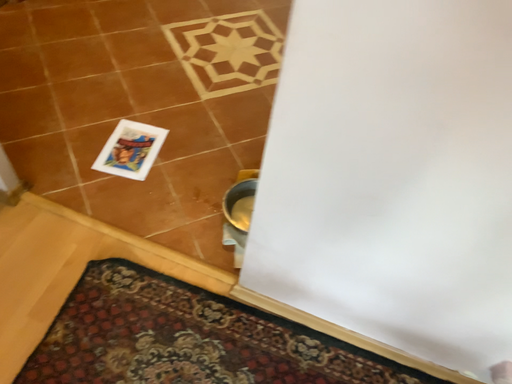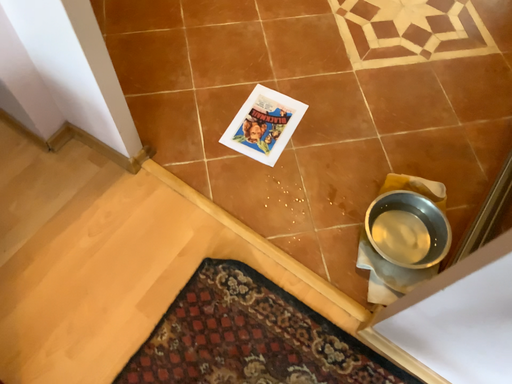
Question: How did the camera likely rotate when shooting the video?

Choices:
 (A) rotated right
 (B) rotated left

Answer: (B)